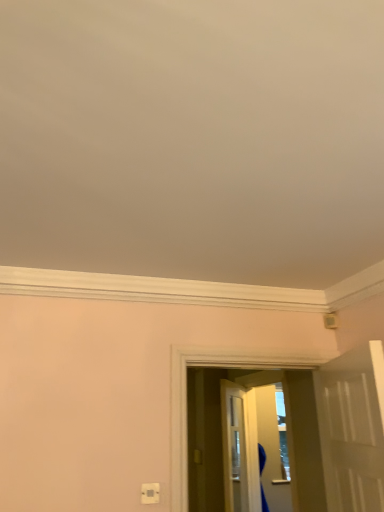
Question: From the image's perspective, is white glossy door at right above white plastic electric outlet at lower center?

Choices:
 (A) yes
 (B) no

Answer: (A)

Question: Is white glossy door at right surrounding white plastic electric outlet at lower center?

Choices:
 (A) yes
 (B) no

Answer: (B)

Question: Is white glossy door at right turned away from white plastic electric outlet at lower center?

Choices:
 (A) no
 (B) yes

Answer: (A)

Question: Is white glossy door at right aimed at white plastic electric outlet at lower center?

Choices:
 (A) yes
 (B) no

Answer: (A)

Question: Is white glossy door at right far from white plastic electric outlet at lower center?

Choices:
 (A) no
 (B) yes

Answer: (A)

Question: Does white glossy door at right have a lesser height compared to white plastic electric outlet at lower center?

Choices:
 (A) no
 (B) yes

Answer: (A)

Question: Can you confirm if white plastic electric outlet at lower center is bigger than white glossy door at right?

Choices:
 (A) no
 (B) yes

Answer: (A)

Question: Is white plastic electric outlet at lower center facing towards white glossy door at right?

Choices:
 (A) yes
 (B) no

Answer: (B)

Question: Can you confirm if white plastic electric outlet at lower center is smaller than white glossy door at right?

Choices:
 (A) no
 (B) yes

Answer: (B)

Question: Is white plastic electric outlet at lower center not near white glossy door at right?

Choices:
 (A) no
 (B) yes

Answer: (A)

Question: Is white plastic electric outlet at lower center to the right of white glossy door at right from the viewer's perspective?

Choices:
 (A) no
 (B) yes

Answer: (A)

Question: Does white plastic electric outlet at lower center have a greater height compared to white glossy door at right?

Choices:
 (A) no
 (B) yes

Answer: (A)

Question: From the image's perspective, is white plastic electric outlet at lower center located above transparent plastic screen door at center?

Choices:
 (A) yes
 (B) no

Answer: (A)